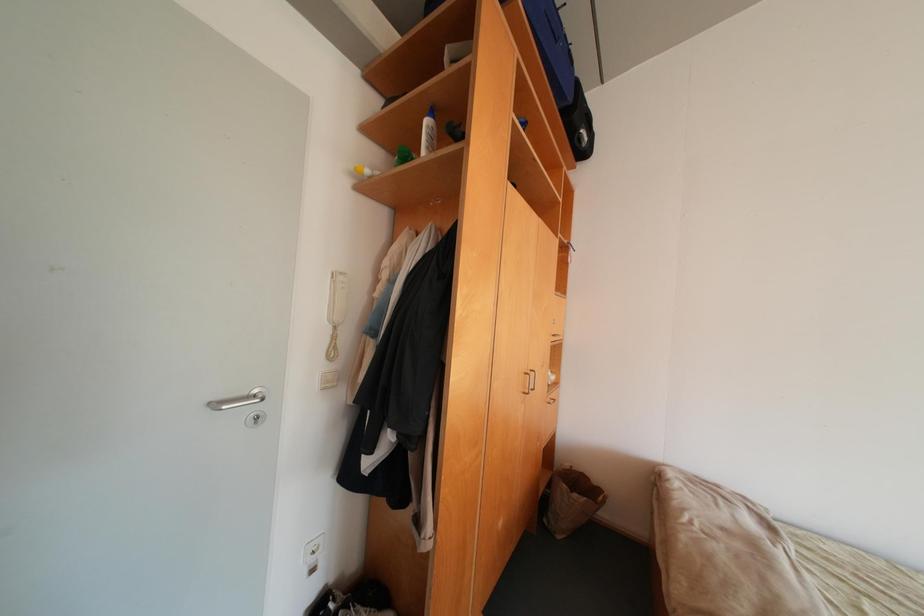
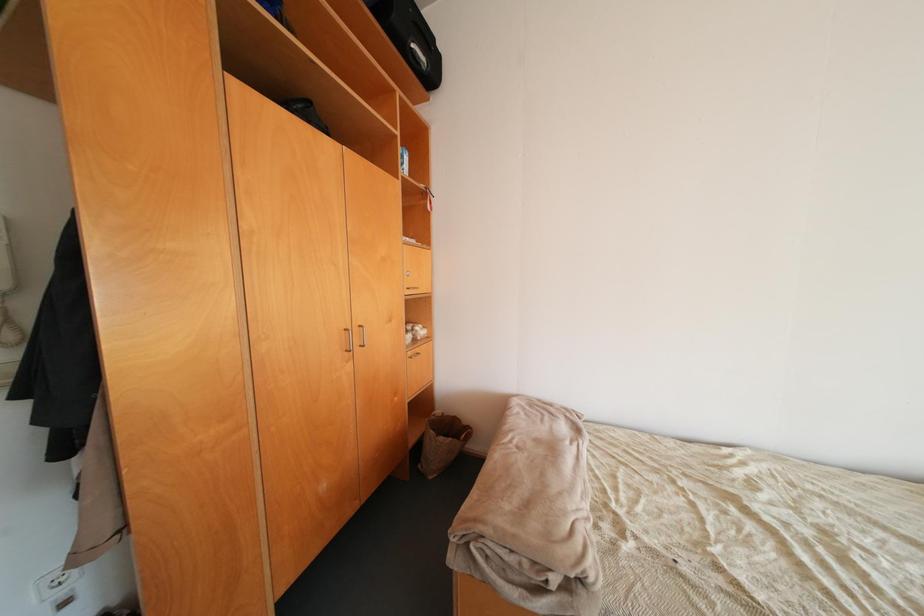
Question: The camera is either moving clockwise (left) or counter-clockwise (right) around the object. The first image is from the beginning of the video and the second image is from the end. Is the camera moving left or right when shooting the video?

Choices:
 (A) Left
 (B) Right

Answer: (A)